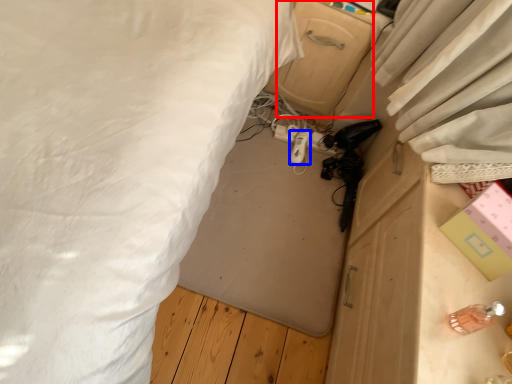
Question: Which of the following is the closest to the observer, drawer (highlighted by a red box) or equipment (highlighted by a blue box)?

Choices:
 (A) drawer
 (B) equipment

Answer: (A)